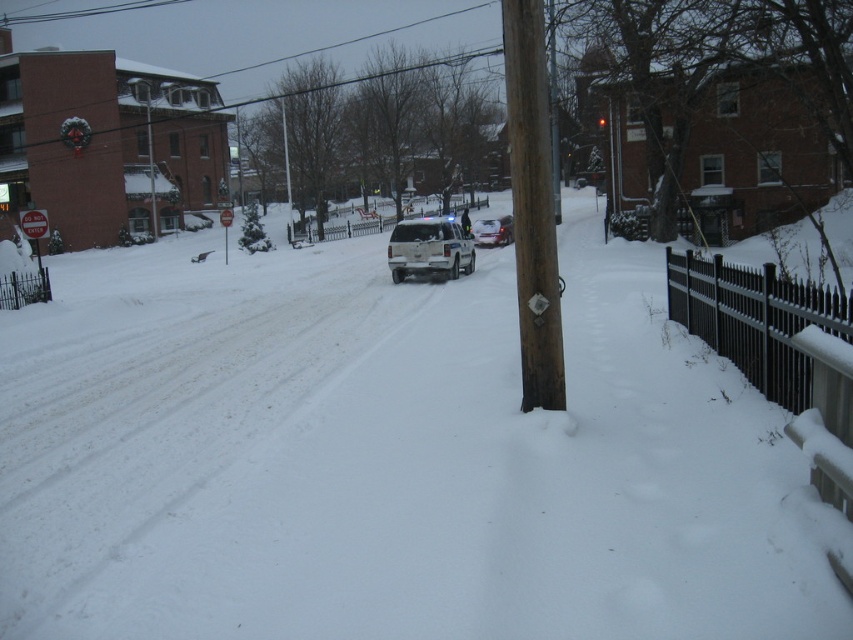
This screenshot has height=640, width=853. In order to click on metallic silver sign at left in this screenshot , I will do `click(33, 227)`.

Can you confirm if metallic silver sign at left is smaller than red plastic stop sign at center?

Incorrect, metallic silver sign at left is not smaller in size than red plastic stop sign at center.

This screenshot has height=640, width=853. What do you see at coordinates (33, 227) in the screenshot? I see `metallic silver sign at left` at bounding box center [33, 227].

The height and width of the screenshot is (640, 853). What are the coordinates of `metallic silver sign at left` in the screenshot? It's located at (33, 227).

Who is positioned more to the right, white fluffy snow at center or silver metallic sedan at center?

From the viewer's perspective, silver metallic sedan at center appears more on the right side.

What do you see at coordinates (386, 458) in the screenshot? I see `white fluffy snow at center` at bounding box center [386, 458].

Is point (19, 508) closer to viewer compared to point (495, 241)?

That is True.

Find the location of a particular element. white fluffy snow at center is located at coordinates (386, 458).

Is white fluffy snow at center positioned in front of brown wooden pole at center?

Yes, it is in front of brown wooden pole at center.

Is white fluffy snow at center above brown wooden pole at center?

No, white fluffy snow at center is not above brown wooden pole at center.

Which is behind, point (630, 348) or point (547, 140)?

Point (630, 348)

At what (x,y) coordinates should I click in order to perform the action: click on white fluffy snow at center. Please return your answer as a coordinate pair (x, y). The image size is (853, 640). Looking at the image, I should click on (386, 458).